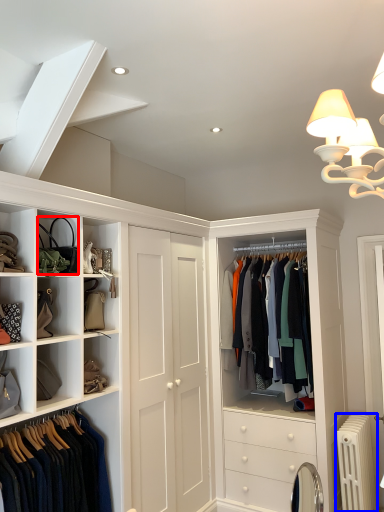
Question: Which point is further to the camera, accessory (highlighted by a red box) or radiator (highlighted by a blue box)?

Choices:
 (A) accessory
 (B) radiator

Answer: (B)